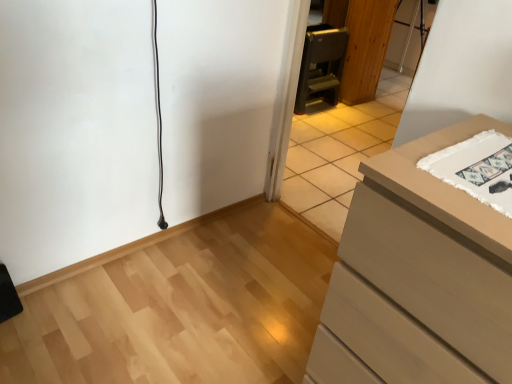
At what (x,y) coordinates should I click in order to perform the action: click on matte beige chest of drawers at lower right. Please return your answer as a coordinate pair (x, y). This screenshot has width=512, height=384. Looking at the image, I should click on (418, 278).

Describe the element at coordinates (418, 278) in the screenshot. This screenshot has height=384, width=512. I see `matte beige chest of drawers at lower right` at that location.

Identify the location of matte beige chest of drawers at lower right. The width and height of the screenshot is (512, 384). (418, 278).